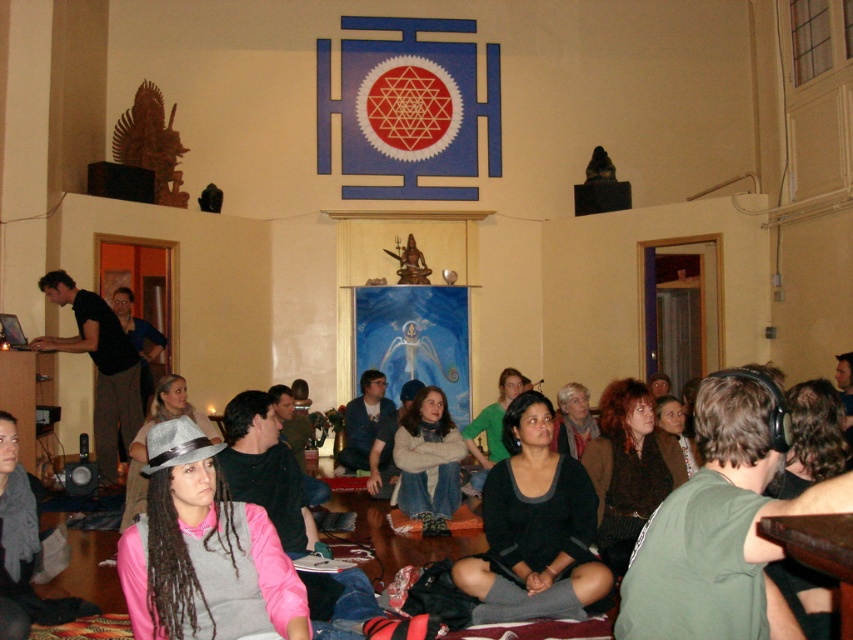
Looking at this image, you are organizing a photo shoot and need to ensure that the two participants wearing the black matte sweater at center and the black shirt at left are seated side by side. Given their clothing dimensions, which participant should be seated on the side to allow more space for movement?

The participant wearing the black matte sweater at center should be seated on the side since its width is larger than the black shirt at left, allowing more space for movement.

You are organizing a photo shoot and need to arrange two participants wearing the black matte sweater at center and the black shirt at left. Based on their clothing sizes, which participant should you place closer to the camera to ensure both appear equally sized in the final image?

The participant wearing the black matte sweater at center, which is smaller in size, should be placed closer to the camera. This adjustment will help balance their apparent sizes in the photo since the black matte sweater at center is smaller than the black shirt at left.